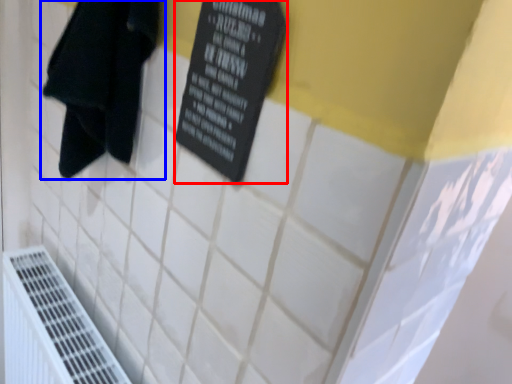
Question: Which of the following is the closest to the observer, bulletin board (highlighted by a red box) or towel (highlighted by a blue box)?

Choices:
 (A) bulletin board
 (B) towel

Answer: (A)